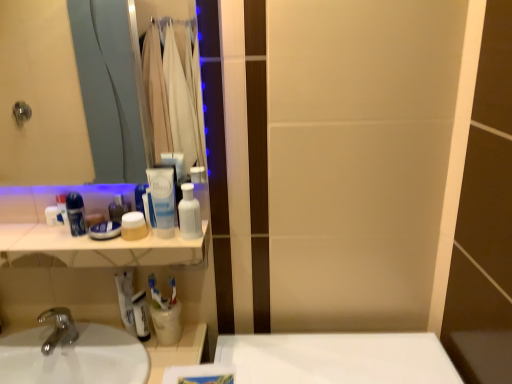
Where is `free space above white glossy counter top at upper left (from a real-world perspective)`? The image size is (512, 384). free space above white glossy counter top at upper left (from a real-world perspective) is located at coordinates (69, 239).